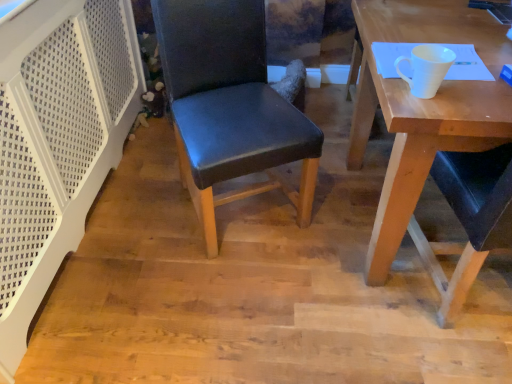
Question: Considering the relative sizes of black leather chair at center and white matte cup at upper right in the image provided, is black leather chair at center shorter than white matte cup at upper right?

Choices:
 (A) no
 (B) yes

Answer: (A)

Question: From a real-world perspective, is black leather chair at center physically above white matte cup at upper right?

Choices:
 (A) yes
 (B) no

Answer: (B)

Question: From the image's perspective, is black leather chair at center located above white matte cup at upper right?

Choices:
 (A) yes
 (B) no

Answer: (A)

Question: Can you confirm if black leather chair at center is taller than white matte cup at upper right?

Choices:
 (A) yes
 (B) no

Answer: (A)

Question: Is black leather chair at center not within white matte cup at upper right?

Choices:
 (A) no
 (B) yes

Answer: (B)

Question: Choose the correct answer: Is white matte cup at upper right inside black leather chair at center or outside it?

Choices:
 (A) outside
 (B) inside

Answer: (A)

Question: From a real-world perspective, is white matte cup at upper right above or below black leather chair at center?

Choices:
 (A) below
 (B) above

Answer: (B)

Question: Considering the positions of white matte cup at upper right and black leather chair at center in the image, is white matte cup at upper right wider or thinner than black leather chair at center?

Choices:
 (A) wide
 (B) thin

Answer: (B)

Question: From their relative heights in the image, would you say white matte cup at upper right is taller or shorter than black leather chair at center?

Choices:
 (A) short
 (B) tall

Answer: (A)

Question: Is black leather chair at center in front of or behind white matte cup at upper right in the image?

Choices:
 (A) behind
 (B) front

Answer: (A)

Question: In terms of width, does black leather chair at center look wider or thinner when compared to white matte cup at upper right?

Choices:
 (A) wide
 (B) thin

Answer: (A)

Question: Is black leather chair at center taller or shorter than white matte cup at upper right?

Choices:
 (A) short
 (B) tall

Answer: (B)

Question: Based on their sizes in the image, would you say black leather chair at center is bigger or smaller than white matte cup at upper right?

Choices:
 (A) small
 (B) big

Answer: (B)

Question: From a real-world perspective, is wooden desk at right above or below black leather chair at center?

Choices:
 (A) below
 (B) above

Answer: (A)

Question: Based on their sizes in the image, would you say wooden desk at right is bigger or smaller than black leather chair at center?

Choices:
 (A) big
 (B) small

Answer: (A)